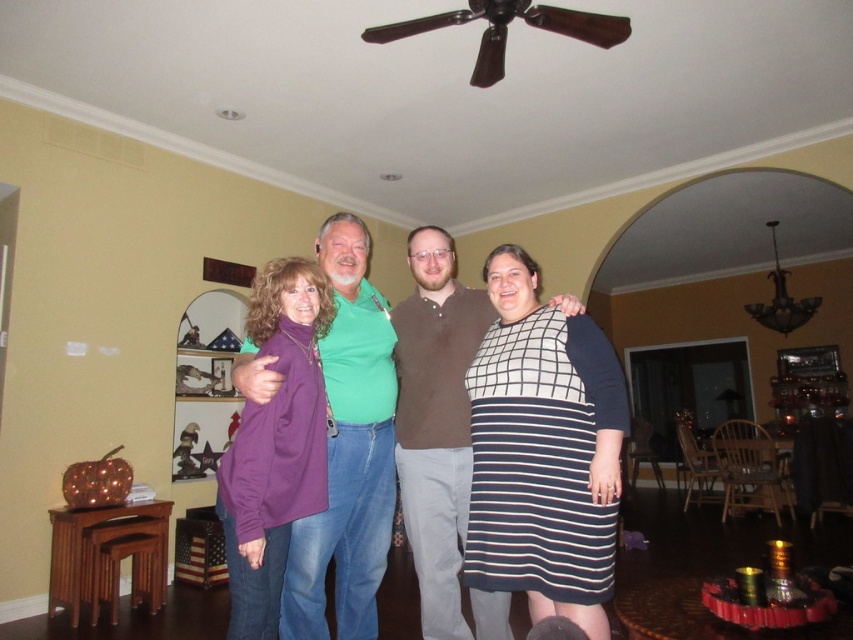
Question: Based on their relative distances, which object is farther from the purple fleece sweater at center?

Choices:
 (A) brown cotton shirt at center
 (B) matte green shirt at center
 (C) striped knit dress at center
 (D) green matte shirt at center

Answer: (C)

Question: Which of the following is the farthest from the observer?

Choices:
 (A) purple fleece sweater at center
 (B) brown cotton shirt at center

Answer: (B)

Question: Does matte green shirt at center come in front of brown cotton shirt at center?

Choices:
 (A) yes
 (B) no

Answer: (A)

Question: Which is nearer to the striped knit dress at center?

Choices:
 (A) matte green shirt at center
 (B) green matte shirt at center
 (C) purple fleece sweater at center

Answer: (A)

Question: Does matte green shirt at center lie behind green matte shirt at center?

Choices:
 (A) yes
 (B) no

Answer: (A)

Question: In this image, where is matte green shirt at center located relative to purple fleece sweater at center?

Choices:
 (A) below
 (B) above

Answer: (A)